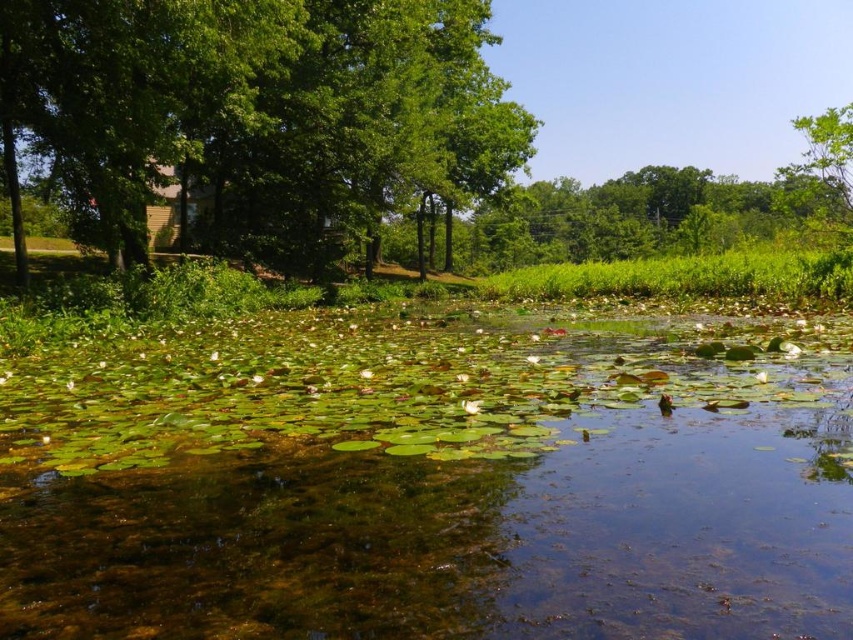
Question: Does green leafy tree at upper left lie in front of green leafy tree at upper right?

Choices:
 (A) yes
 (B) no

Answer: (A)

Question: Observing the image, what is the correct spatial positioning of green leafy water at center in reference to green leafy tree at upper right?

Choices:
 (A) below
 (B) above

Answer: (A)

Question: Based on their relative distances, which object is farther from the green leafy tree at upper left?

Choices:
 (A) green leafy water at center
 (B) green leafy tree at upper right

Answer: (B)

Question: Can you confirm if green leafy tree at upper left is wider than green leafy tree at upper right?

Choices:
 (A) yes
 (B) no

Answer: (B)

Question: Which object is the closest to the green leafy tree at upper left?

Choices:
 (A) green leafy tree at upper right
 (B) green leafy water at center

Answer: (B)

Question: Which point is farther from the camera taking this photo?

Choices:
 (A) (790, 449)
 (B) (122, 230)
 (C) (828, 160)

Answer: (B)